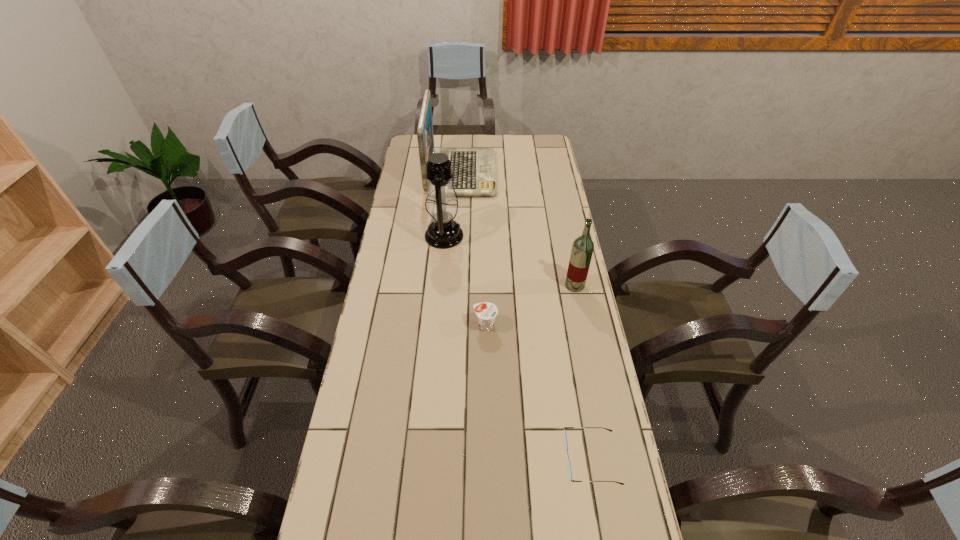
Where is `free spot located on the back of the second shortest object`? The width and height of the screenshot is (960, 540). free spot located on the back of the second shortest object is located at coordinates (485, 278).

Image resolution: width=960 pixels, height=540 pixels. In order to click on vacant area situated 0.200m on the lenses of the spectacles in this screenshot , I will do `click(488, 458)`.

Find the location of a particular element. The width and height of the screenshot is (960, 540). free space located 0.250m on the lenses of the spectacles is located at coordinates (468, 458).

Locate an element on the screen. free space located on the lenses of the spectacles is located at coordinates (434, 458).

Identify the location of object at the far edge. This screenshot has width=960, height=540. (474, 169).

Where is `oil lamp that is at the left edge`? The width and height of the screenshot is (960, 540). oil lamp that is at the left edge is located at coordinates (443, 232).

Find the location of `laptop computer present at the left edge`. laptop computer present at the left edge is located at coordinates (474, 169).

At what (x,y) coordinates should I click in order to perform the action: click on liquor present at the right edge. Please return your answer as a coordinate pair (x, y). The image size is (960, 540). Looking at the image, I should click on (582, 249).

Locate an element on the screen. This screenshot has height=540, width=960. spectacles that is at the right edge is located at coordinates (564, 435).

Identify the location of object that is at the far left corner. (474, 169).